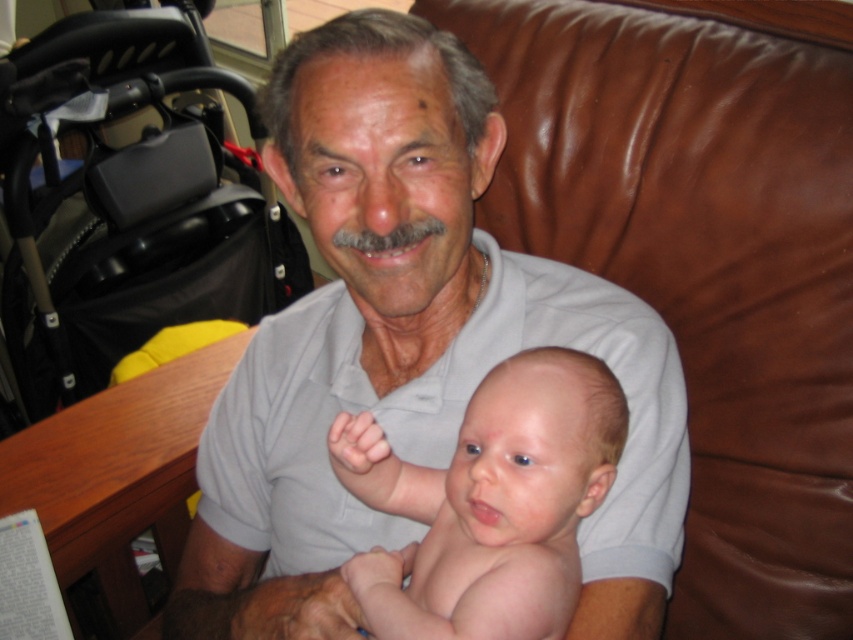
Question: Which point is farther from the camera taking this photo?

Choices:
 (A) (265, 624)
 (B) (241, 321)

Answer: (B)

Question: Which point is farther from the camera taking this photo?

Choices:
 (A) (74, 257)
 (B) (566, 420)
 (C) (387, 408)

Answer: (A)

Question: Which is farther from the gray cotton shirt at center?

Choices:
 (A) smooth skin baby at center
 (B) black plastic stroller at left

Answer: (B)

Question: Does black plastic stroller at left appear over smooth skin baby at center?

Choices:
 (A) yes
 (B) no

Answer: (A)

Question: Can you confirm if black plastic stroller at left is thinner than smooth skin baby at center?

Choices:
 (A) no
 (B) yes

Answer: (A)

Question: Is gray cotton shirt at center to the right of smooth skin baby at center from the viewer's perspective?

Choices:
 (A) no
 (B) yes

Answer: (A)